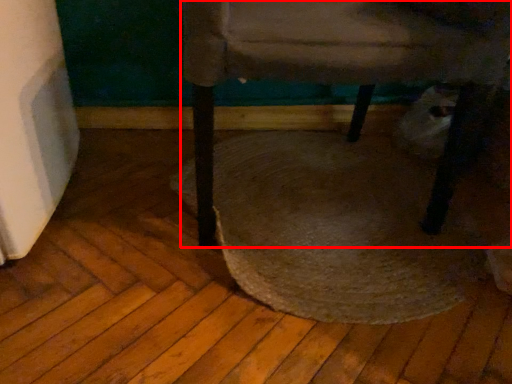
Question: From the image's perspective, what is the correct spatial relationship of chair (annotated by the red box) in relation to mat?

Choices:
 (A) above
 (B) below

Answer: (A)